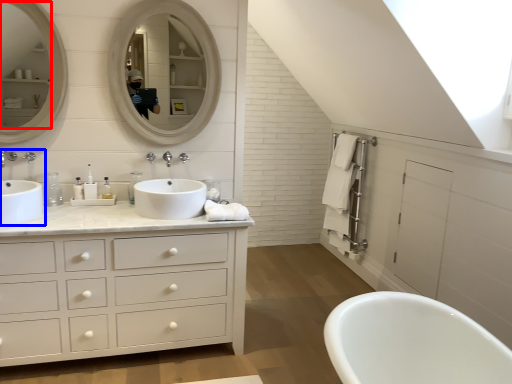
Question: Which of the following is the closest to the observer, mirror (highlighted by a red box) or sink (highlighted by a blue box)?

Choices:
 (A) mirror
 (B) sink

Answer: (B)